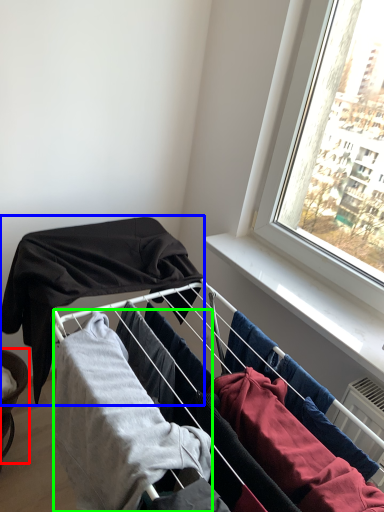
Question: Which object is the closest to the furniture (highlighted by a red box)? Choose among these: clothing (highlighted by a blue box) or clothing (highlighted by a green box).

Choices:
 (A) clothing
 (B) clothing

Answer: (A)